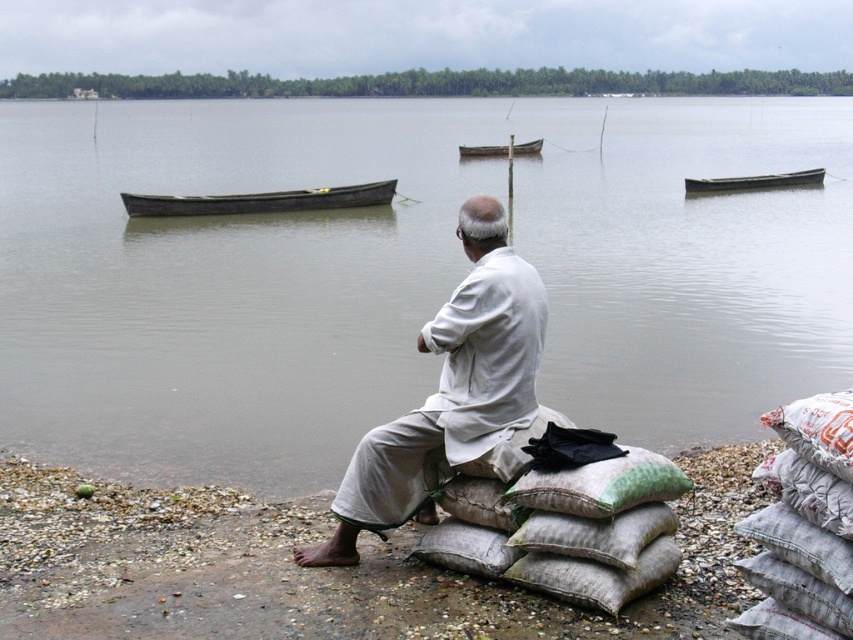
Is point (16, 168) farther from camera compared to point (457, 150)?

No, (16, 168) is closer to viewer.

Between point (715, 376) and point (519, 148), which one is positioned behind?

The point (519, 148) is behind.

The image size is (853, 640). I want to click on clear water at center, so click(x=404, y=273).

Who is positioned more to the right, clear water at center or dark gray wooden boat at center?

From the viewer's perspective, clear water at center appears more on the right side.

Between clear water at center and dark gray wooden boat at center, which one has more height?

clear water at center is taller.

Which is in front, point (376, 138) or point (289, 195)?

Point (289, 195) is more forward.

Where is `clear water at center`? The image size is (853, 640). clear water at center is located at coordinates (404, 273).

Can you confirm if gray gravel shoreline at lower left is wider than dark gray wooden boat at center?

Incorrect, gray gravel shoreline at lower left's width does not surpass dark gray wooden boat at center's.

Is point (59, 636) closer to camera compared to point (289, 198)?

That is True.

At what (x,y) coordinates should I click in order to perform the action: click on gray gravel shoreline at lower left. Please return your answer as a coordinate pair (x, y). Looking at the image, I should click on (322, 570).